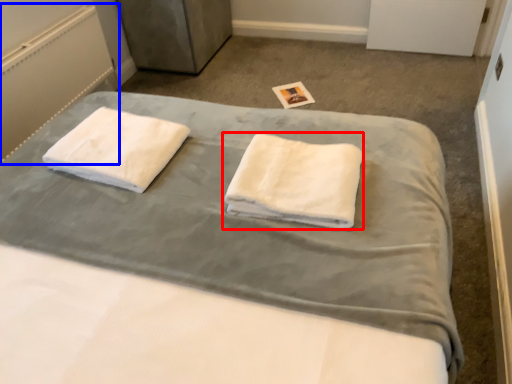
Question: Which object is closer to the camera taking this photo, towel (highlighted by a red box) or radiator (highlighted by a blue box)?

Choices:
 (A) towel
 (B) radiator

Answer: (A)